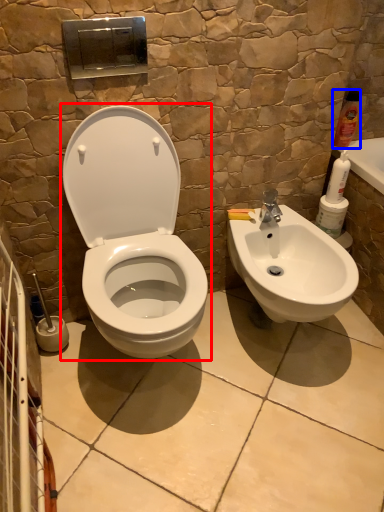
Question: Which point is further to the camera, toilet (highlighted by a red box) or cleaning product (highlighted by a blue box)?

Choices:
 (A) toilet
 (B) cleaning product

Answer: (B)